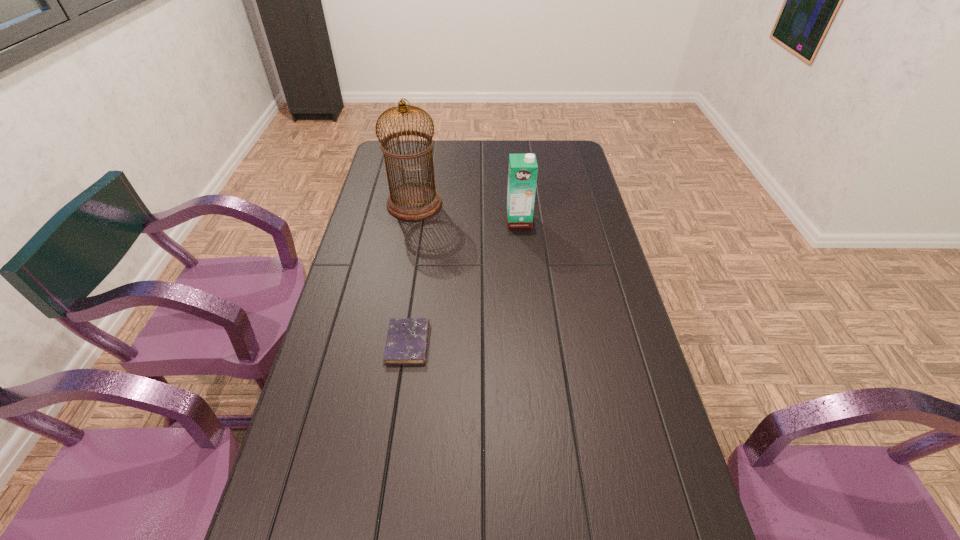
You are a GUI agent. You are given a task and a screenshot of the screen. Output one action in this format:
    pyautogui.click(x=<x>, y=<y>)
    Task: Click on the tallest object
    
    Given the screenshot: What is the action you would take?
    pyautogui.click(x=410, y=201)

Find the location of a particular element. the rightmost object is located at coordinates (522, 173).

Identify the location of the second shortest object. The width and height of the screenshot is (960, 540). (522, 173).

Identify the location of diary. The image size is (960, 540). tap(407, 338).

Image resolution: width=960 pixels, height=540 pixels. I want to click on the nearest object, so click(407, 338).

Where is `vacant region located on the front-facing side of the tallest object`? This screenshot has height=540, width=960. vacant region located on the front-facing side of the tallest object is located at coordinates (460, 204).

Locate an element on the screen. This screenshot has width=960, height=540. vacant space situated 0.280m on the front of the second tallest object is located at coordinates (525, 285).

I want to click on free space located 0.140m on the front of the nearest object, so click(397, 414).

Find the location of `object that is at the left edge`. object that is at the left edge is located at coordinates (410, 201).

The image size is (960, 540). What are the coordinates of `free region at the far edge of the desktop` in the screenshot? It's located at [540, 150].